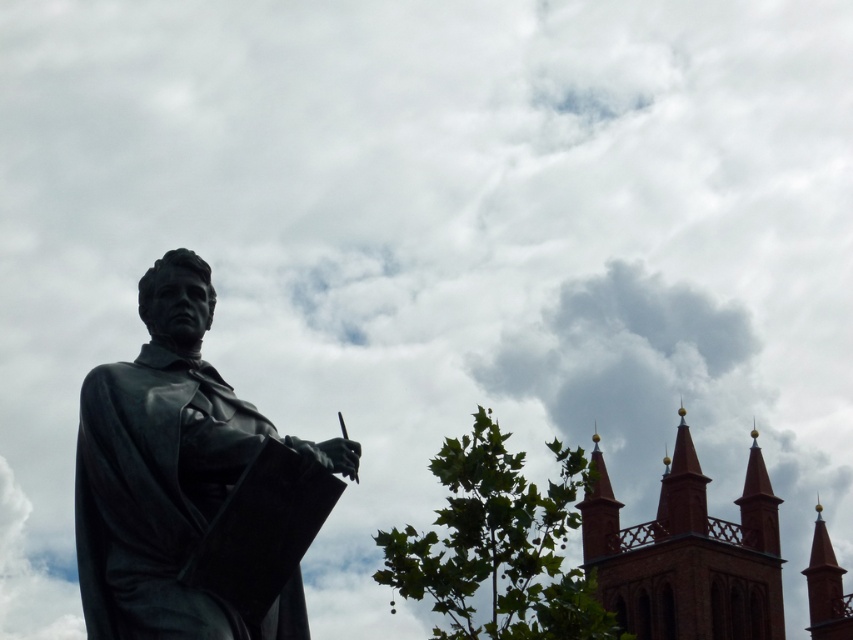
You are an architect analyzing the church in the background. You notice two structures at the upper right corner of the image. Which one is the smaller one between the brick steeple at upper right and the brick spire at upper right?

The brick steeple at upper right is smaller than the brick spire at upper right.